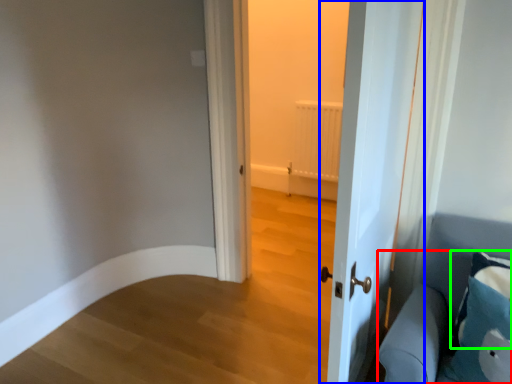
Question: Considering the real-world distances, which object is farthest from furniture (highlighted by a red box)? door (highlighted by a blue box) or pillow (highlighted by a green box)?

Choices:
 (A) door
 (B) pillow

Answer: (A)